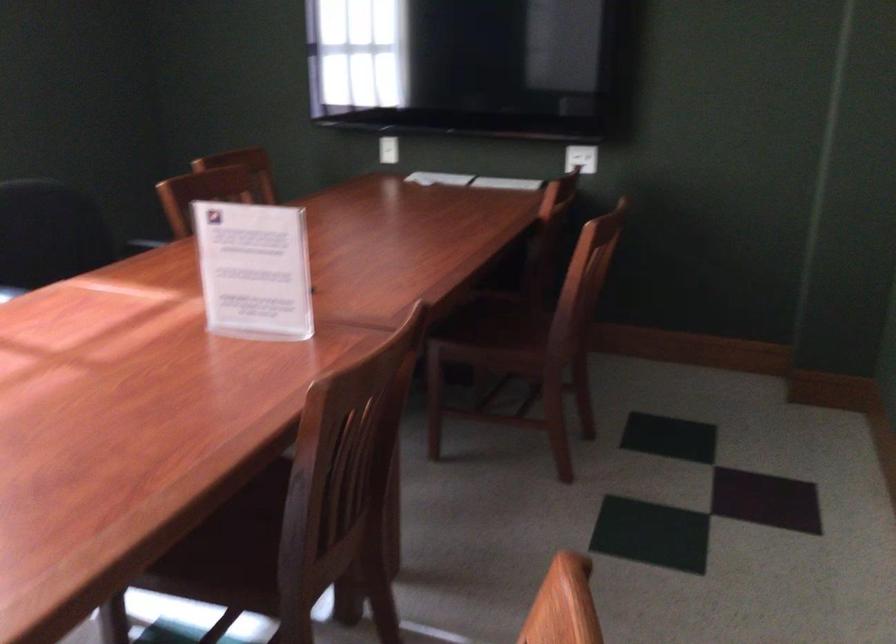
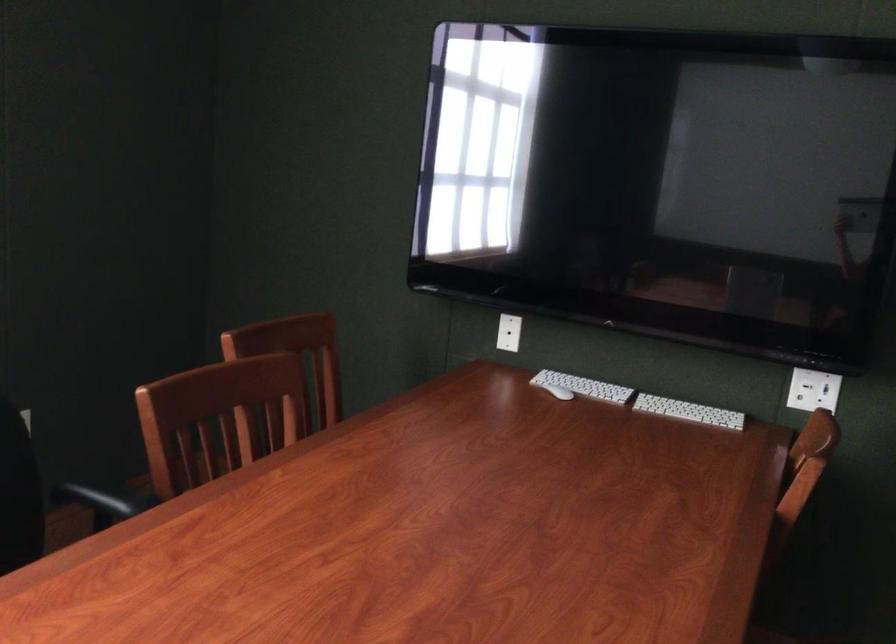
In the second image, find the point that corresponds to (x=582, y=156) in the first image.

(813, 390)